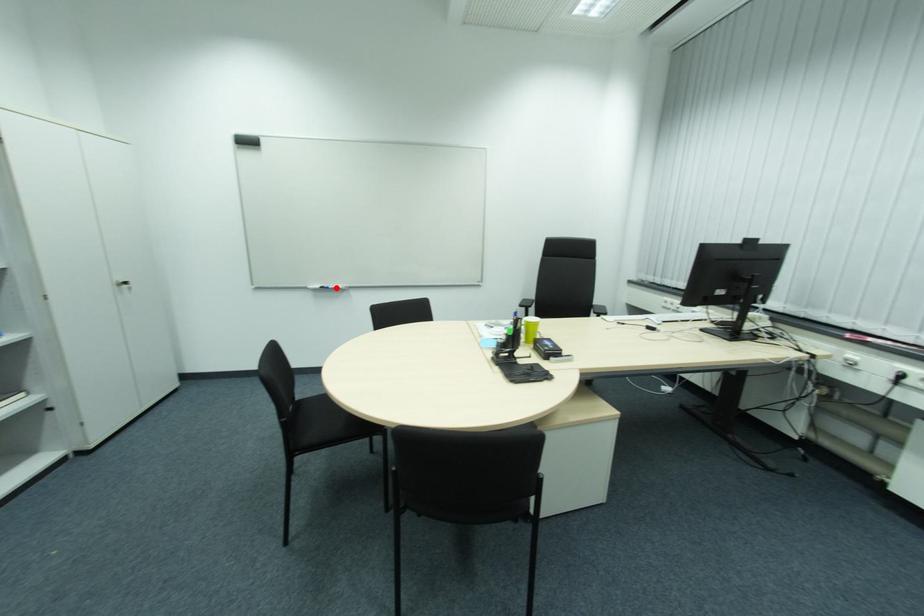
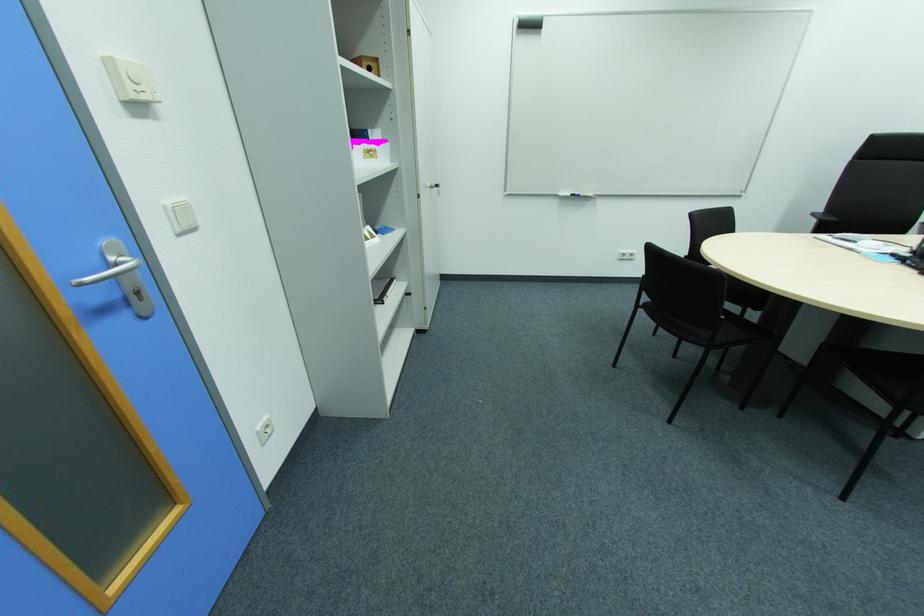
Question: I am providing you with two images of the same scene from different viewpoints. In image1, a red point is highlighted. Considering the same 3D point in image2, which of the following is correct?

Choices:
 (A) It is closer
 (B) It is farther

Answer: (A)